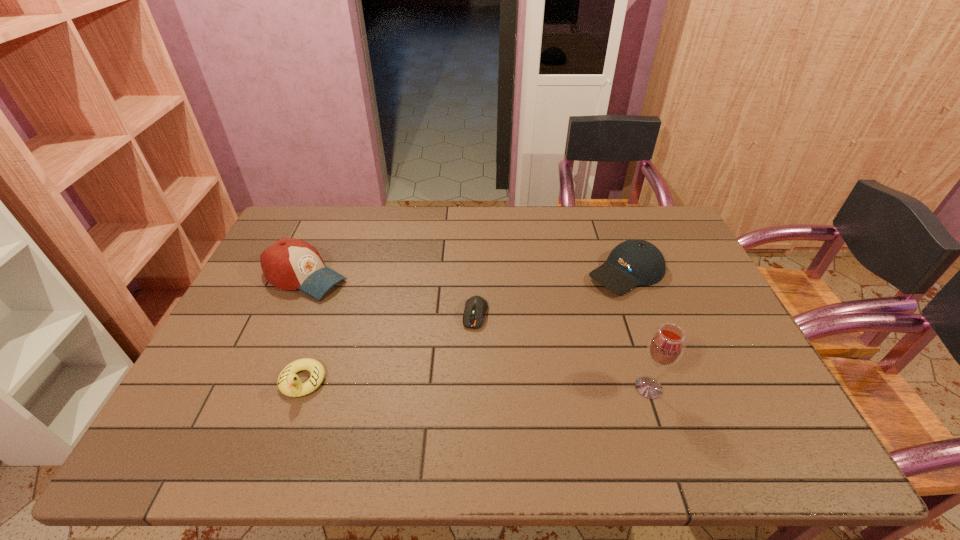
Find the location of a particular element. object that is positioned at the left edge is located at coordinates (289, 264).

What are the coordinates of `object present at the right edge` in the screenshot? It's located at (632, 263).

This screenshot has height=540, width=960. I want to click on vacant region at the far edge, so 357,215.

The width and height of the screenshot is (960, 540). I want to click on free space at the near edge of the desktop, so click(x=620, y=414).

Locate an element on the screen. Image resolution: width=960 pixels, height=540 pixels. free region at the near right corner of the desktop is located at coordinates (715, 400).

I want to click on vacant space in between the computer equipment and the left baseball cap, so click(x=390, y=295).

Where is `free space between the second shortest object and the fourth shortest object`? This screenshot has width=960, height=540. free space between the second shortest object and the fourth shortest object is located at coordinates (303, 329).

Identify the location of free space between the tallest object and the right baseball cap. (637, 330).

Where is `blank region between the duckling and the tallest object`? blank region between the duckling and the tallest object is located at coordinates (475, 384).

At what (x,y) coordinates should I click in order to perform the action: click on vacant area that lies between the second shortest object and the right baseball cap. Please return your answer as a coordinate pair (x, y). Looking at the image, I should click on (465, 327).